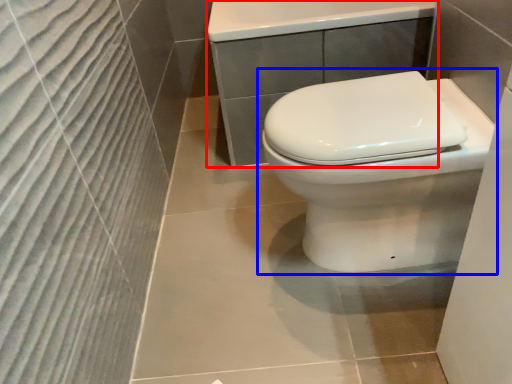
Question: Which object is closer to the camera taking this photo, porcelain (highlighted by a red box) or toilet (highlighted by a blue box)?

Choices:
 (A) porcelain
 (B) toilet

Answer: (B)